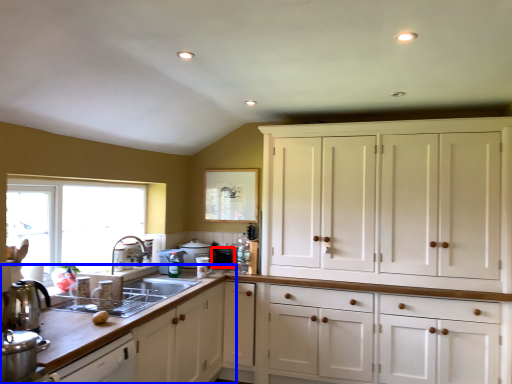
Question: Which object appears closest to the camera in this image, appliance (highlighted by a red box) or countertop (highlighted by a blue box)?

Choices:
 (A) appliance
 (B) countertop

Answer: (B)